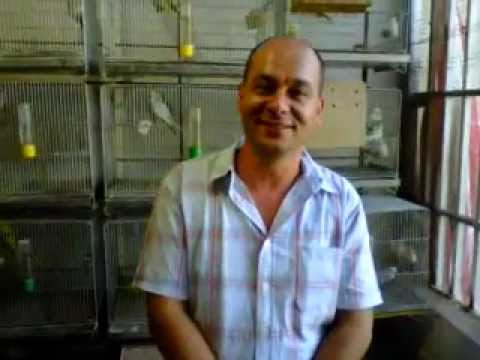
Where is `window sill`? window sill is located at coordinates click(464, 329).